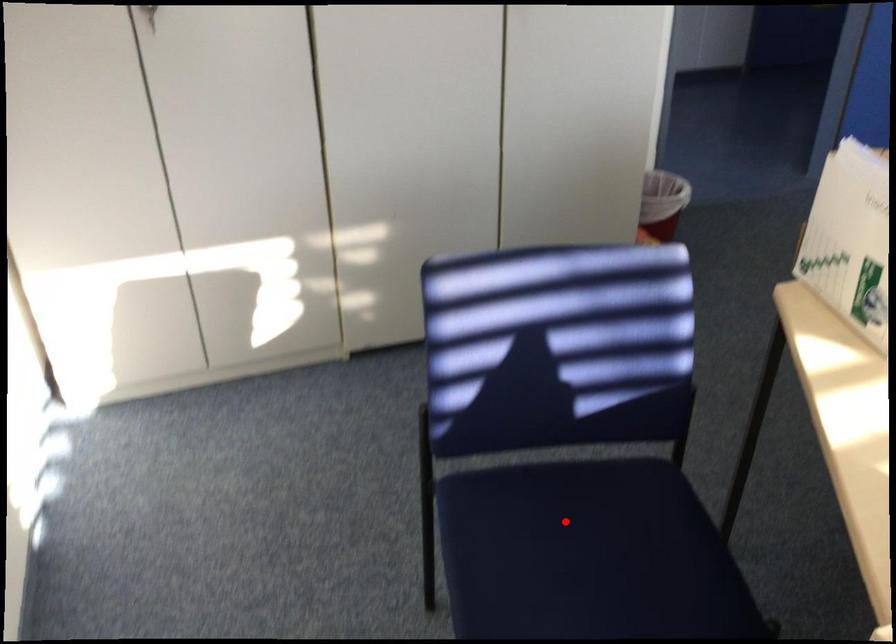
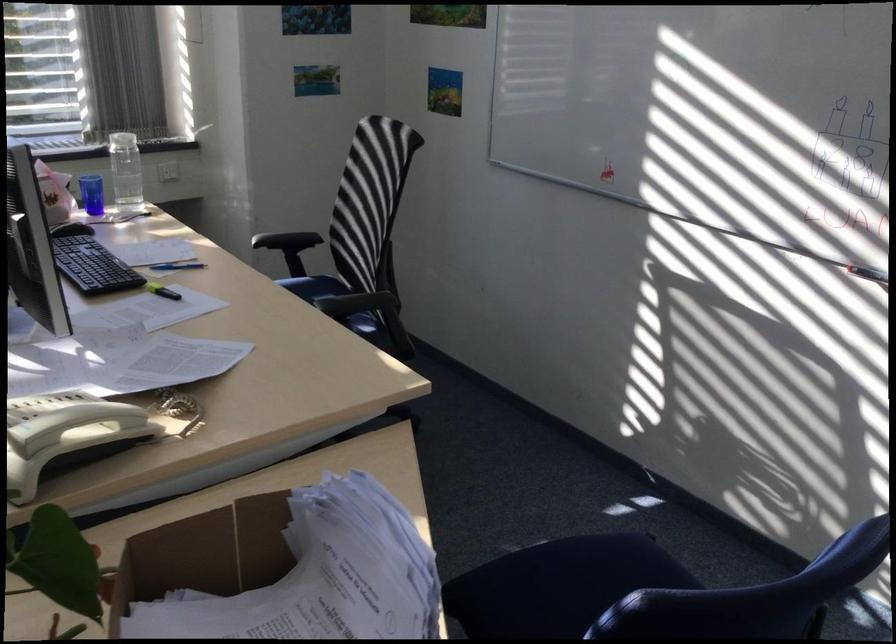
Find the pixel in the second image that matches the highlighted location in the first image.

(557, 585)